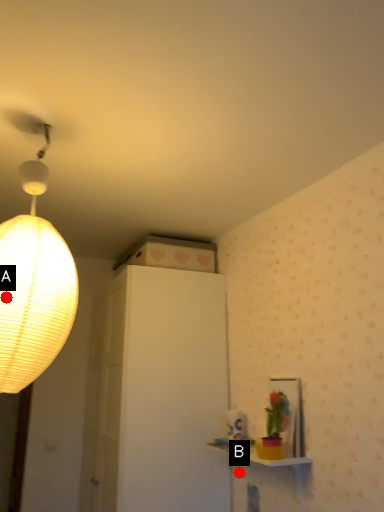
Question: Two points are circled on the image, labeled by A and B beside each circle. Which point is further to the camera?

Choices:
 (A) A is further
 (B) B is further

Answer: (B)